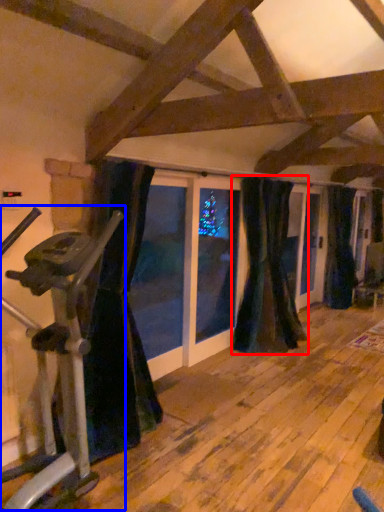
Question: Which object appears closest to the camera in this image, curtain (highlighted by a red box) or stationary bicycle (highlighted by a blue box)?

Choices:
 (A) curtain
 (B) stationary bicycle

Answer: (B)